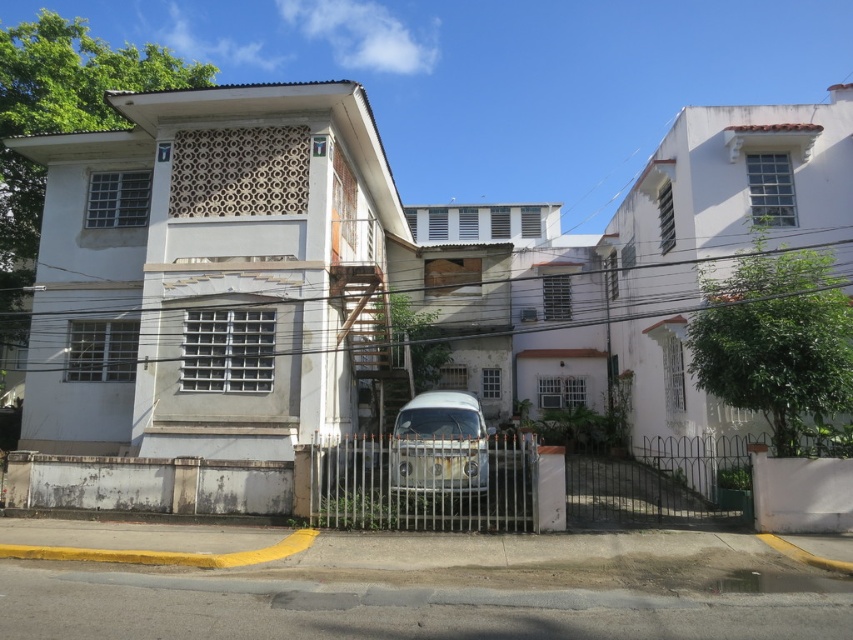
Question: Is metallic gate at center bigger than white matte van at center?

Choices:
 (A) no
 (B) yes

Answer: (B)

Question: Does metallic gate at center have a greater width compared to white matte van at center?

Choices:
 (A) no
 (B) yes

Answer: (B)

Question: Does metallic gate at center appear on the right side of white matte van at center?

Choices:
 (A) yes
 (B) no

Answer: (A)